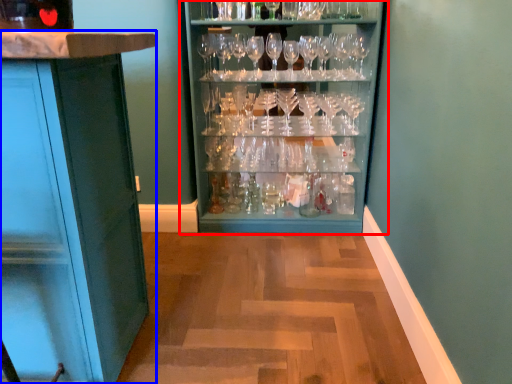
Question: Which object appears closest to the camera in this image, cupboard (highlighted by a red box) or cabinetry (highlighted by a blue box)?

Choices:
 (A) cupboard
 (B) cabinetry

Answer: (B)